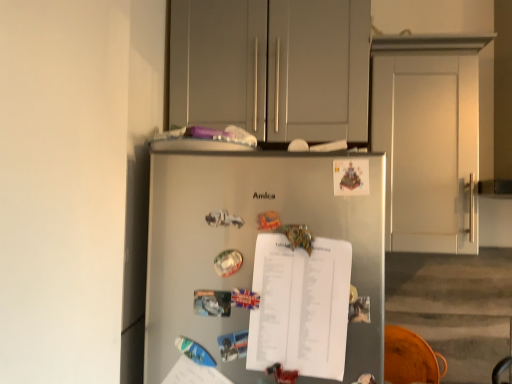
Question: Is white paper at center bigger or smaller than white matte door at upper right?

Choices:
 (A) small
 (B) big

Answer: (A)

Question: From their relative heights in the image, would you say white paper at center is taller or shorter than white matte door at upper right?

Choices:
 (A) short
 (B) tall

Answer: (A)

Question: Based on their relative distances, which object is farther from the white paper at center?

Choices:
 (A) orange wood swivel chair at lower right
 (B) white matte door at upper right
 (C) matte gray cabinets at upper center
 (D) satin silver refrigerator at center

Answer: (A)

Question: Estimate the real-world distances between objects in this image. Which object is farther from the matte gray cabinets at upper center?

Choices:
 (A) orange wood swivel chair at lower right
 (B) satin silver refrigerator at center
 (C) white paper at center
 (D) white matte door at upper right

Answer: (A)